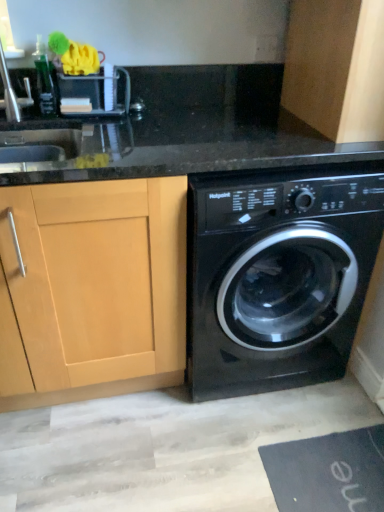
Locate an element on the screen. free location above black glossy washing machine at lower right (from a real-world perspective) is located at coordinates (272, 133).